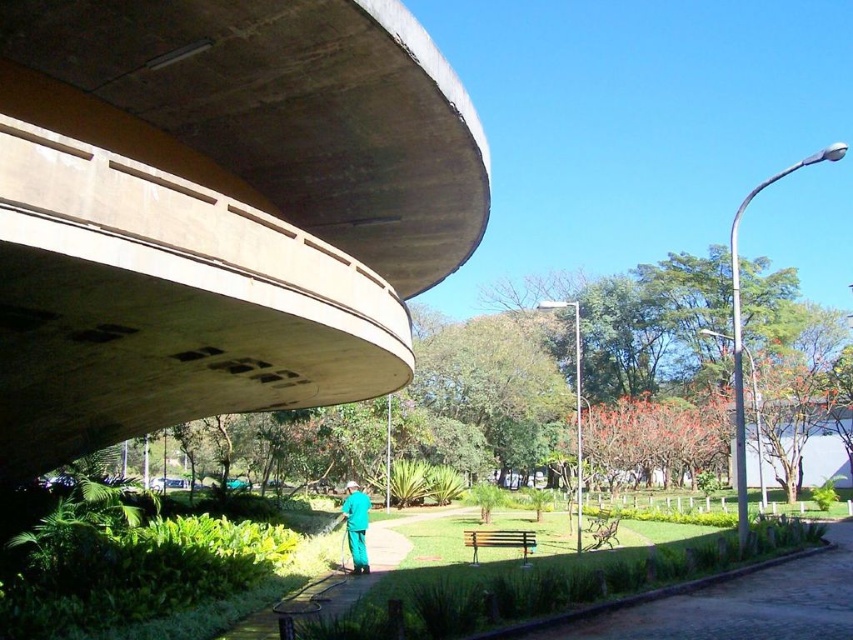
Question: Which point is farther to the camera?

Choices:
 (A) (846, 600)
 (B) (10, 172)

Answer: (A)

Question: Considering the relative positions of concrete at upper left and green matte uniform at center in the image provided, where is concrete at upper left located with respect to green matte uniform at center?

Choices:
 (A) above
 (B) below

Answer: (A)

Question: Is green grass at lower center wider than green matte uniform at center?

Choices:
 (A) yes
 (B) no

Answer: (A)

Question: Estimate the real-world distances between objects in this image. Which object is closer to the concrete at upper left?

Choices:
 (A) green matte uniform at center
 (B) green grass at lower center

Answer: (A)

Question: Can you confirm if green grass at lower center is thinner than green matte uniform at center?

Choices:
 (A) yes
 (B) no

Answer: (B)

Question: Which of these objects is positioned closest to the green matte uniform at center?

Choices:
 (A) concrete at upper left
 (B) green grass at lower center

Answer: (A)